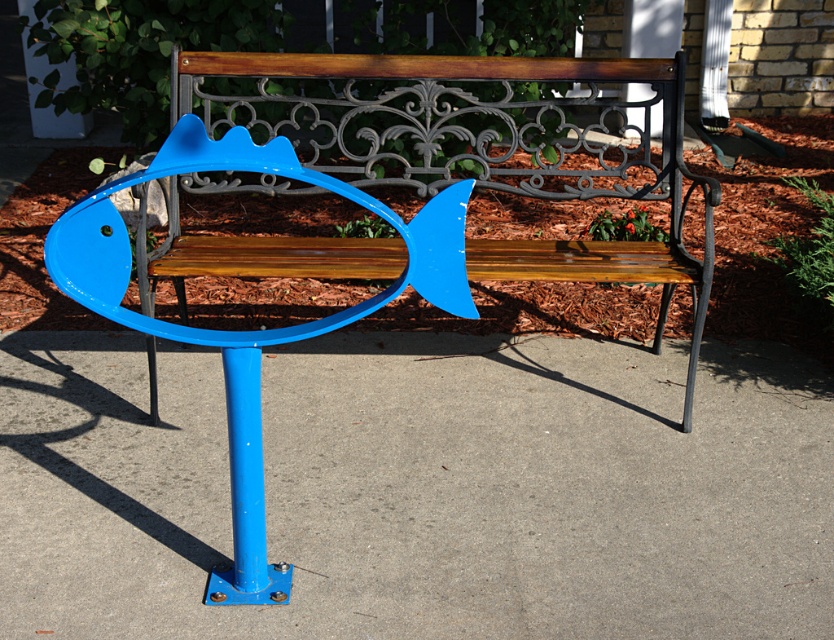
Question: Among these objects, which one is farthest from the camera?

Choices:
 (A) blue painted metal fish at center
 (B) blue metal pole at center

Answer: (A)

Question: Does blue metal pole at center have a greater width compared to blue painted metal fish at center?

Choices:
 (A) yes
 (B) no

Answer: (A)

Question: Which of the following is the farthest from the observer?

Choices:
 (A) (613, 138)
 (B) (134, 593)

Answer: (A)

Question: Among these objects, which one is nearest to the camera?

Choices:
 (A) blue painted metal fish at center
 (B) blue metal pole at center

Answer: (B)

Question: Does blue metal pole at center appear on the right side of blue painted metal fish at center?

Choices:
 (A) no
 (B) yes

Answer: (A)

Question: Is blue metal pole at center to the left of blue painted metal fish at center from the viewer's perspective?

Choices:
 (A) no
 (B) yes

Answer: (B)